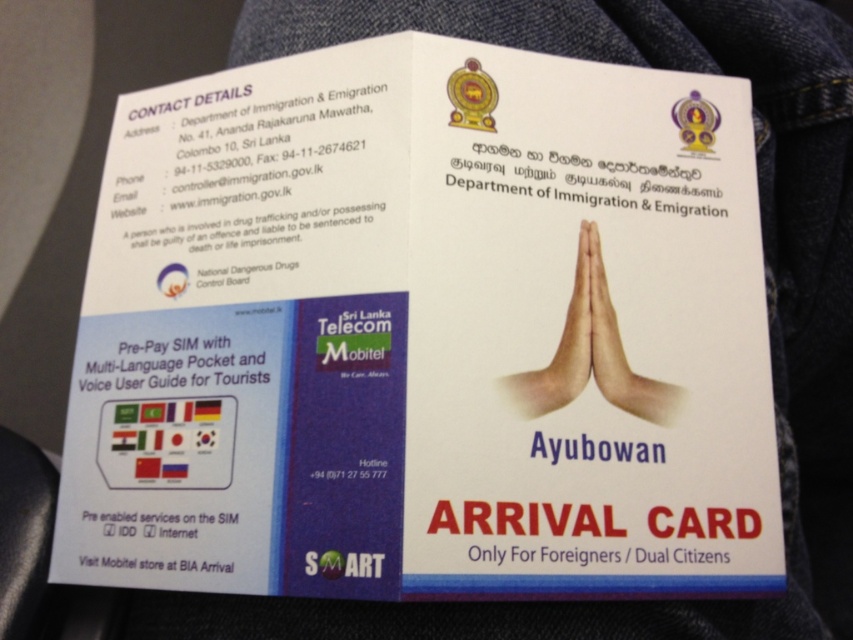
Can you confirm if faded denim jacket at lower right is positioned below white matte hands at center?

Indeed, faded denim jacket at lower right is positioned under white matte hands at center.

Is faded denim jacket at lower right taller than white matte hands at center?

Indeed, faded denim jacket at lower right has a greater height compared to white matte hands at center.

Which is behind, point (824, 532) or point (611, 317)?

The point (824, 532) is behind.

At what (x,y) coordinates should I click in order to perform the action: click on faded denim jacket at lower right. Please return your answer as a coordinate pair (x, y). This screenshot has height=640, width=853. Looking at the image, I should click on (764, 284).